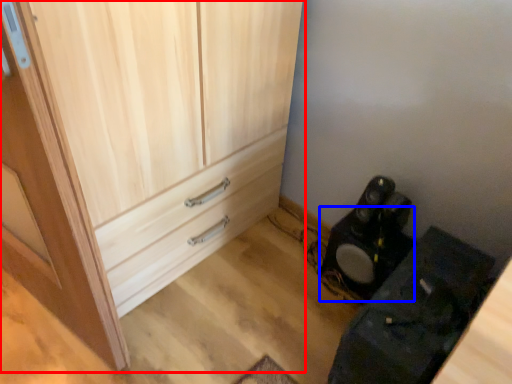
Question: Which object is further to the camera taking this photo, cupboard (highlighted by a red box) or speaker (highlighted by a blue box)?

Choices:
 (A) cupboard
 (B) speaker

Answer: (B)